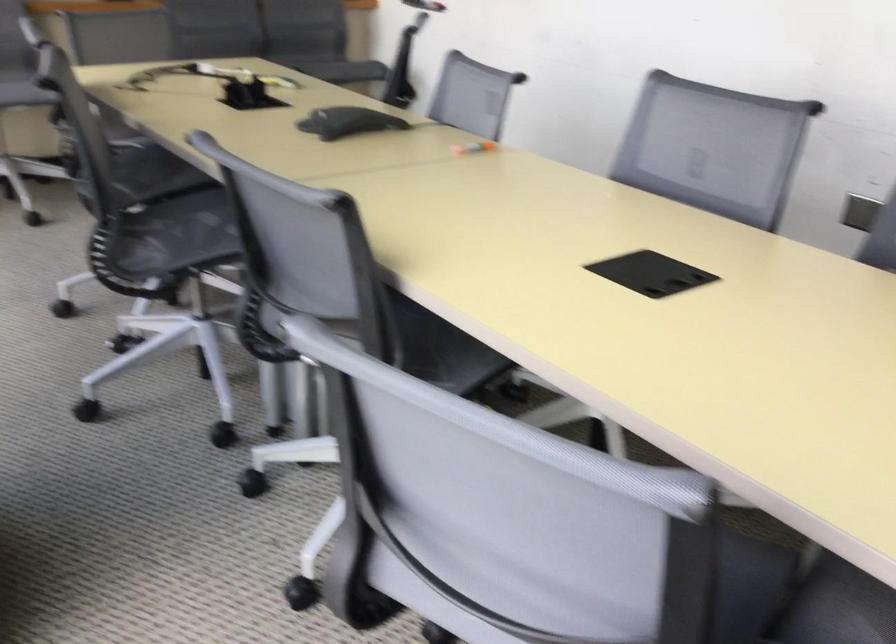
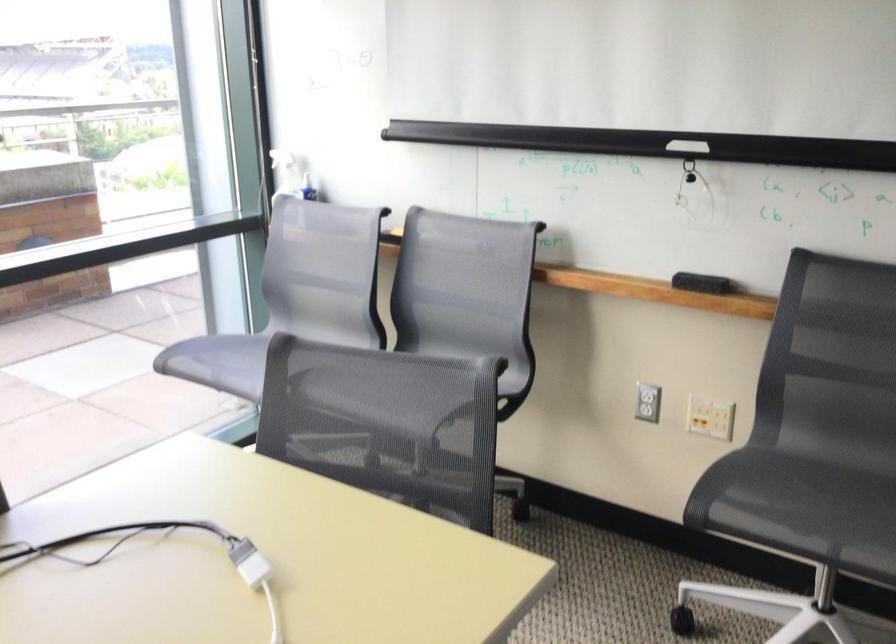
Find the pixel in the second image that matches (167,80) in the first image.

(161, 554)